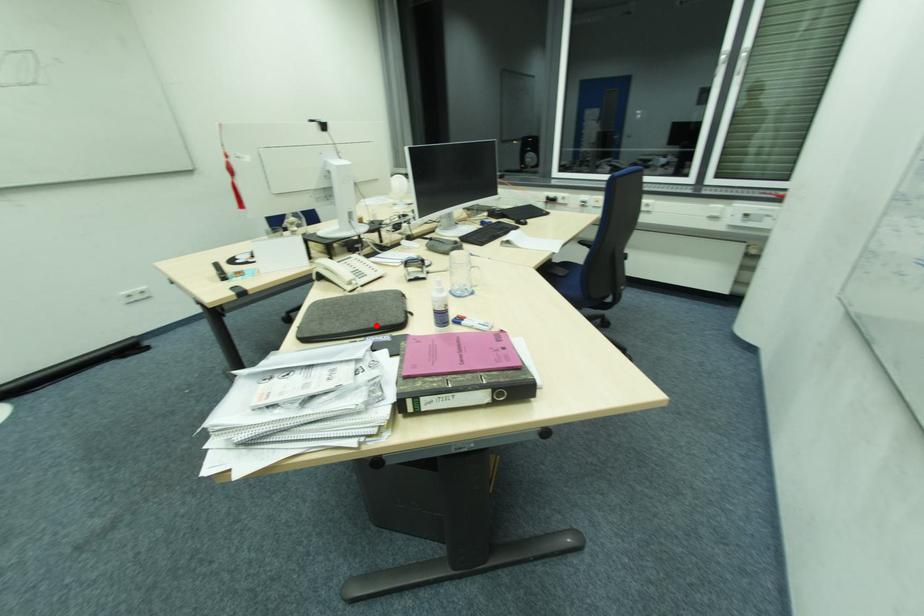
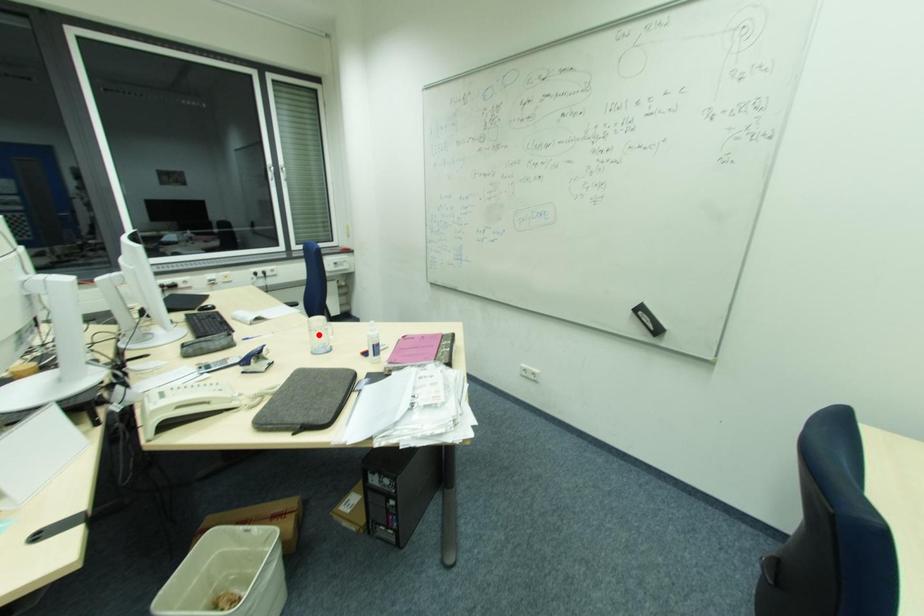
I am providing you with two images of the same scene from different viewpoints. A red point is marked on the first image and another point is marked on the second image. Does the point marked in image1 correspond to the same location as the one in image2?

No